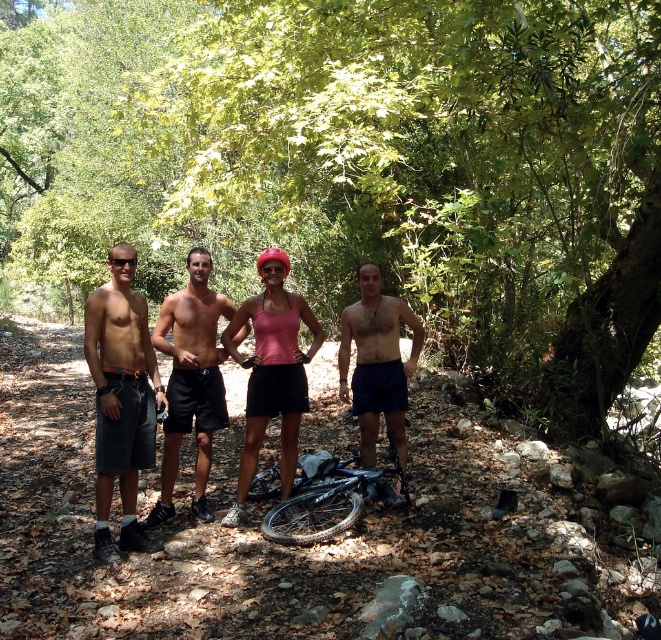
You are a photographer trying to capture a clear photo of the shiny black shorts at center without the green leafy tree at center blocking it. How should you adjust your position?

Move to a position where you can see the shiny black shorts at center not blocked by the green leafy tree at center. Since the shiny black shorts at center is behind the green leafy tree at center, you need to move around to the side or behind the tree to get an unobstructed view.

You are a hiker who wants to know if your backpack can fit between the shiny black shorts at center and the blue matte bicycle at center. The backpack is 0.5 meters wide. Can it fit?

The shiny black shorts at center is smaller than the blue matte bicycle at center, but the exact distance between them isn not specified. Therefore, it is uncertain whether the backpack can fit.

You are a photographer trying to capture a group photo of the individuals in the forest. You notice the shiny black shorts at center and the pink matte tank top at center. Which clothing item should you focus on to ensure it stands out more in the photo?

The pink matte tank top at center should be focused on to ensure it stands out more because it has a larger size compared to the shiny black shorts at center.